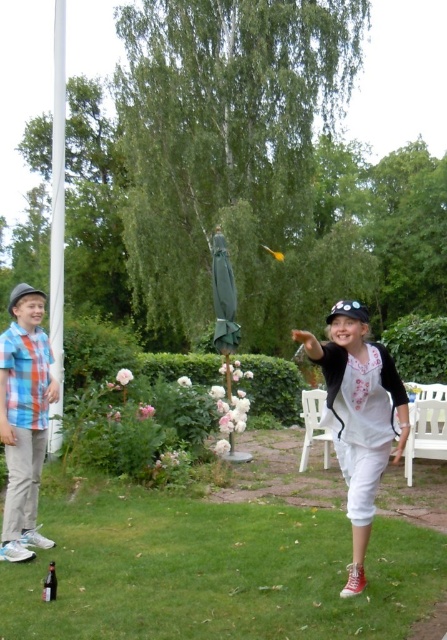
Question: Does blue plaid shirt at left appear on the left side of translucent glass bottle at lower left?

Choices:
 (A) no
 (B) yes

Answer: (B)

Question: Considering the real-world distances, which object is farthest from the blue plaid shirt at left?

Choices:
 (A) white plastic chair at lower right
 (B) white plastic chair at lower center

Answer: (A)

Question: Which of the following is the closest to the observer?

Choices:
 (A) (42, 355)
 (B) (430, 412)
 (C) (53, 593)

Answer: (C)

Question: Does white cotton shirt at center appear on the right side of blue plaid shirt at left?

Choices:
 (A) yes
 (B) no

Answer: (A)

Question: Is blue plaid shirt at left thinner than translucent glass bottle at lower left?

Choices:
 (A) yes
 (B) no

Answer: (B)

Question: Among these points, which one is nearest to the camera?

Choices:
 (A) (442, 448)
 (B) (320, 435)
 (C) (358, 588)

Answer: (C)